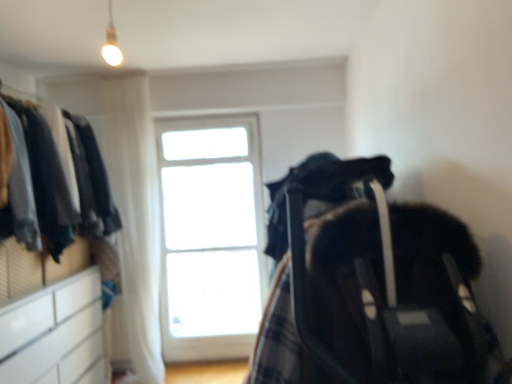
Question: Is point (253, 263) positioned closer to the camera than point (148, 254)?

Choices:
 (A) farther
 (B) closer

Answer: (A)

Question: In the image, is white glass window at center on the left side or the right side of white sheer curtain at upper left?

Choices:
 (A) left
 (B) right

Answer: (B)

Question: Estimate the real-world distances between objects in this image. Which object is closer to the white sheer curtain at upper left?

Choices:
 (A) white glossy/file cabinet at lower left
 (B) white glass window at center
 (C) dark fabric baby carriage at right
 (D) white glossy dresser at left

Answer: (B)

Question: Based on their relative distances, which object is nearer to the white glass window at center?

Choices:
 (A) white sheer curtain at upper left
 (B) white glossy/file cabinet at lower left
 (C) white glossy dresser at left
 (D) dark fabric baby carriage at right

Answer: (A)